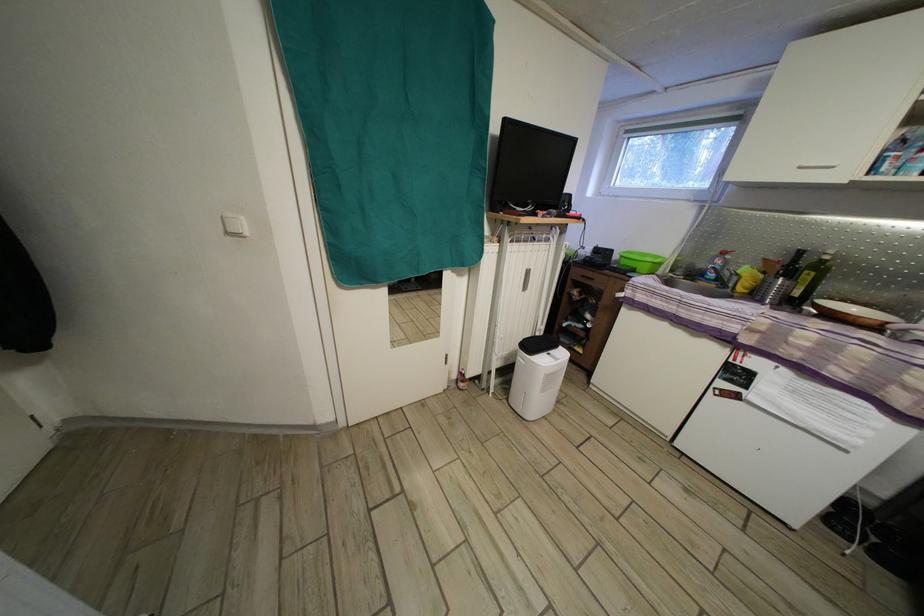
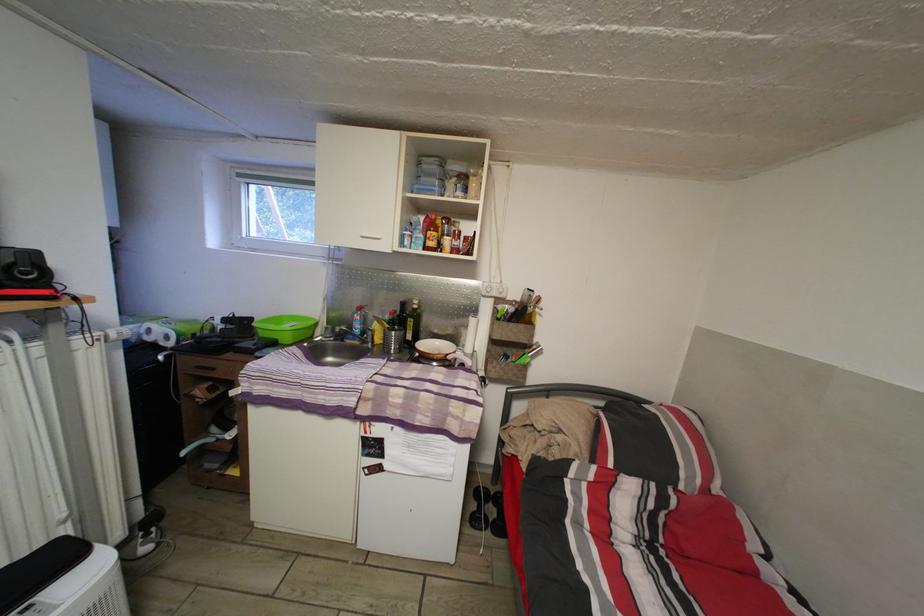
Find the pixel in the second image that matches pixel 807 175 in the first image.

(370, 244)